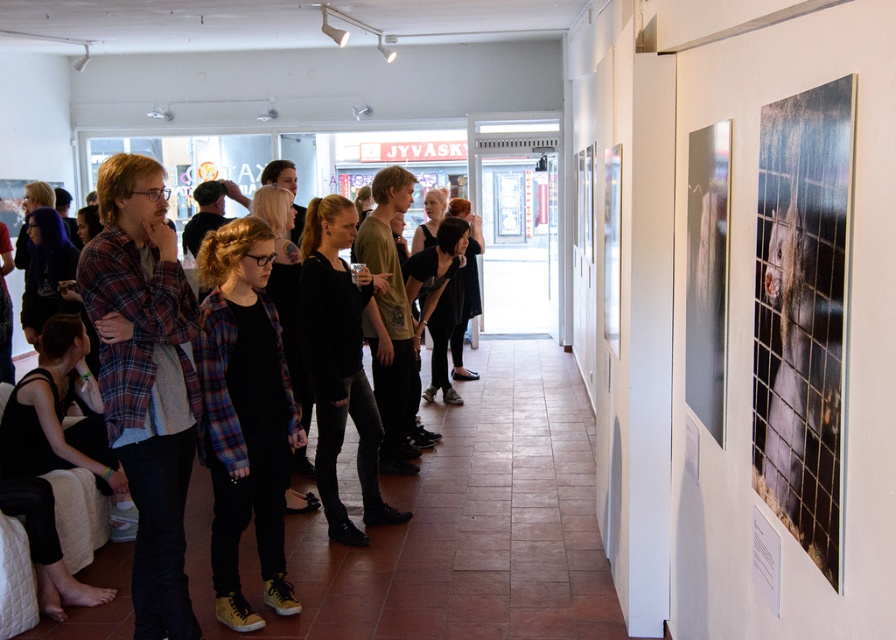
Question: Can you confirm if plaid flannel shirt at center is smaller than black fabric at lower left?

Choices:
 (A) no
 (B) yes

Answer: (B)

Question: In this image, where is matte plaid shirt at left located relative to black fabric at lower left?

Choices:
 (A) left
 (B) right

Answer: (B)

Question: Which point is farther to the camera?

Choices:
 (A) matte plaid shirt at left
 (B) plaid flannel shirt at center

Answer: (B)

Question: Is plaid flannel shirt at center smaller than black fabric at lower left?

Choices:
 (A) no
 (B) yes

Answer: (B)

Question: Which of the following is the closest to the observer?

Choices:
 (A) (125, 275)
 (B) (237, 369)
 (C) (33, 458)

Answer: (A)

Question: Which point appears farthest from the camera in this image?

Choices:
 (A) (41, 346)
 (B) (266, 307)
 (C) (190, 609)

Answer: (A)